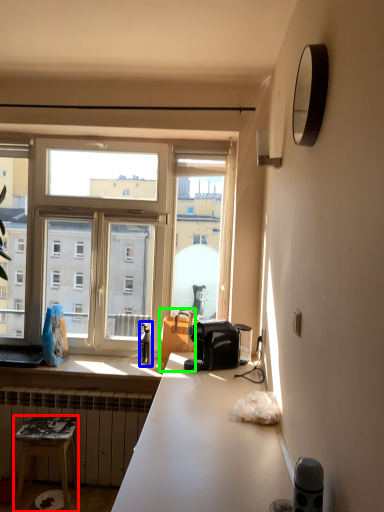
Question: Which is farther away from stool (highlighted by a red box)? bottle (highlighted by a blue box) or handbag (highlighted by a green box)?

Choices:
 (A) bottle
 (B) handbag

Answer: (B)